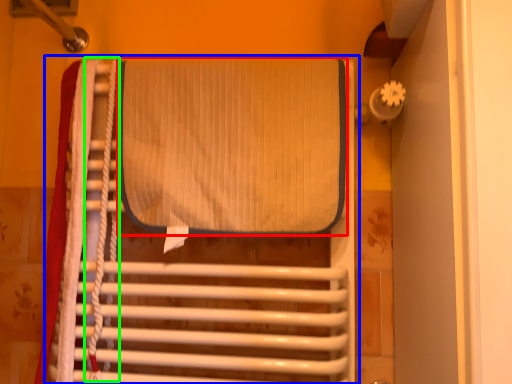
Question: Based on their relative distances, which object is farther from wide (highlighted by a red box)? Choose from furniture (highlighted by a blue box) and rope (highlighted by a green box).

Choices:
 (A) furniture
 (B) rope

Answer: (B)